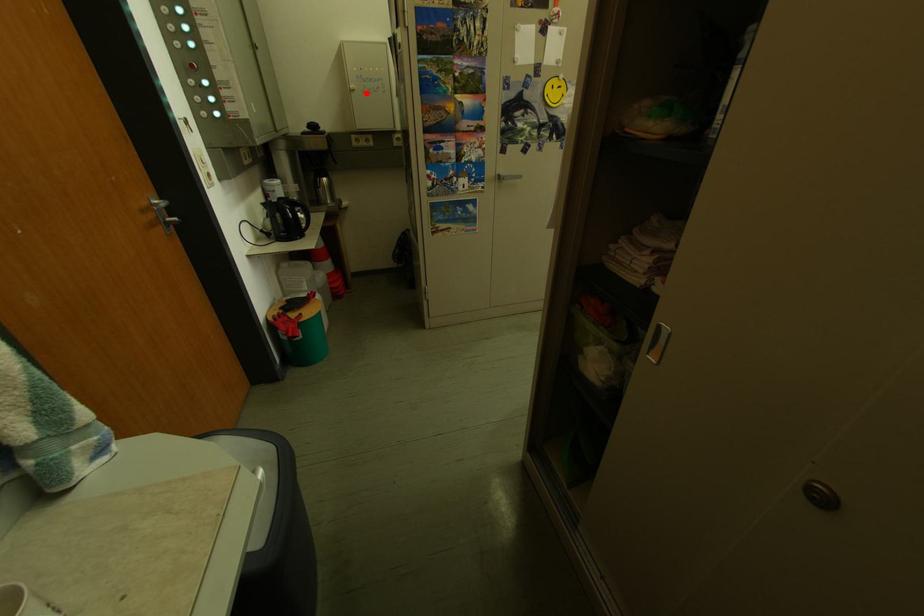
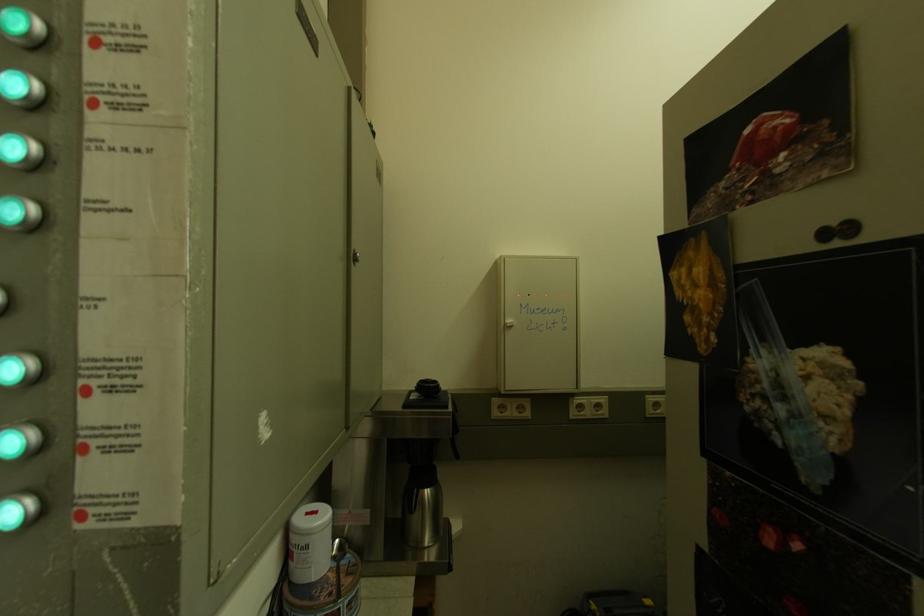
Question: I am providing you with two images of the same scene from different viewpoints. A red point is shown in image1. For the corresponding object point in image2, is it positioned nearer or farther from the camera?

Choices:
 (A) Nearer
 (B) Farther

Answer: (B)